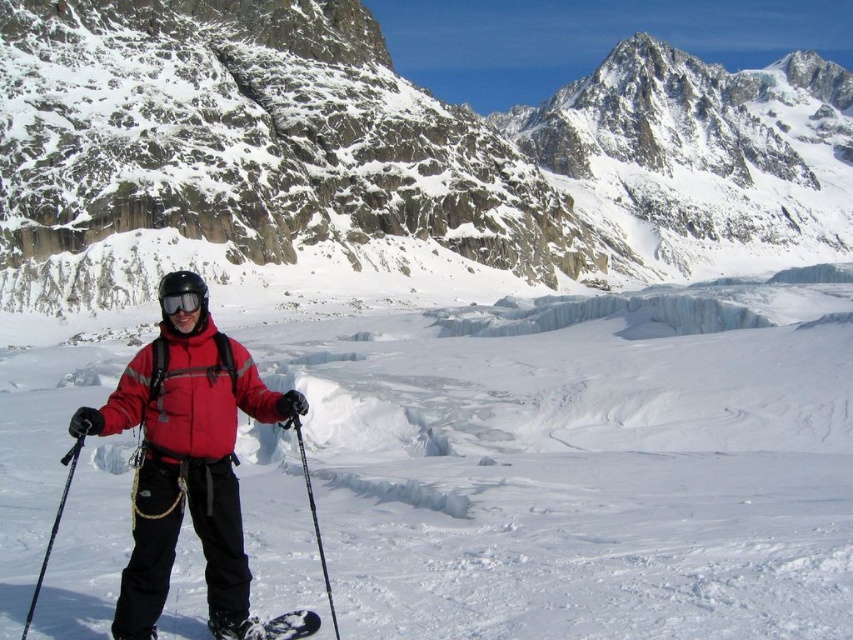
Question: Does black matte ski pole at center have a greater width compared to transparent plastic goggles at center?

Choices:
 (A) no
 (B) yes

Answer: (A)

Question: Which is farther from the black matte ski at lower center?

Choices:
 (A) white matte snow at center
 (B) transparent plastic goggles at center

Answer: (A)

Question: Observing the image, what is the correct spatial positioning of red matte jacket at center in reference to black plastic ski pole at left?

Choices:
 (A) right
 (B) left

Answer: (B)

Question: Estimate the real-world distances between objects in this image. Which object is closer to the red matte jacket at center?

Choices:
 (A) black matte ski at lower center
 (B) matte gray rock at upper center
 (C) black matte ski pole at center
 (D) transparent plastic goggles at center

Answer: (A)

Question: Which point is farther from the camera taking this photo?

Choices:
 (A) (71, 452)
 (B) (500, 472)
 (C) (480, 236)
 (D) (184, 308)

Answer: (C)

Question: Is the position of white matte snow at center less distant than that of black matte ski at lower center?

Choices:
 (A) yes
 (B) no

Answer: (A)